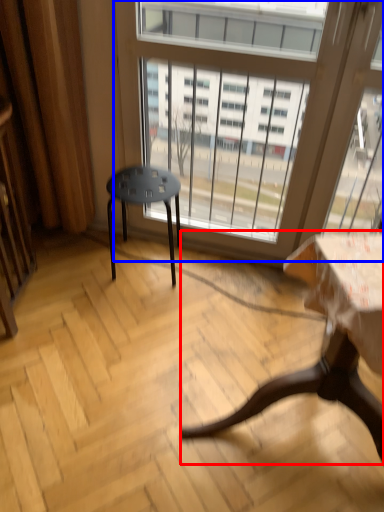
Question: Which point is further to the camera, table (highlighted by a red box) or window (highlighted by a blue box)?

Choices:
 (A) table
 (B) window

Answer: (B)